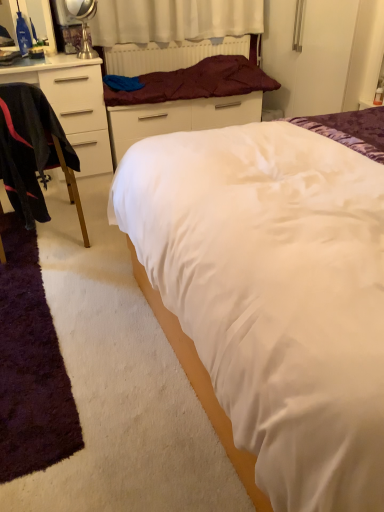
Find the location of `vacant space situated above maroon fabric radiator at upper center (from a real-world perspective)`. vacant space situated above maroon fabric radiator at upper center (from a real-world perspective) is located at coordinates (182, 38).